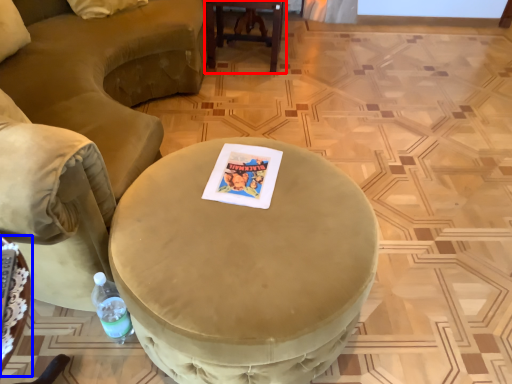
Question: Which of the following is the closest to the observer, table (highlighted by a red box) or table (highlighted by a blue box)?

Choices:
 (A) table
 (B) table

Answer: (B)